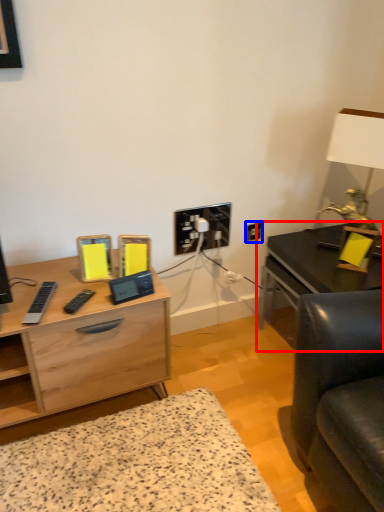
Question: Which of the following is the closest to the observer, table (highlighted by a red box) or electric outlet (highlighted by a blue box)?

Choices:
 (A) table
 (B) electric outlet

Answer: (A)